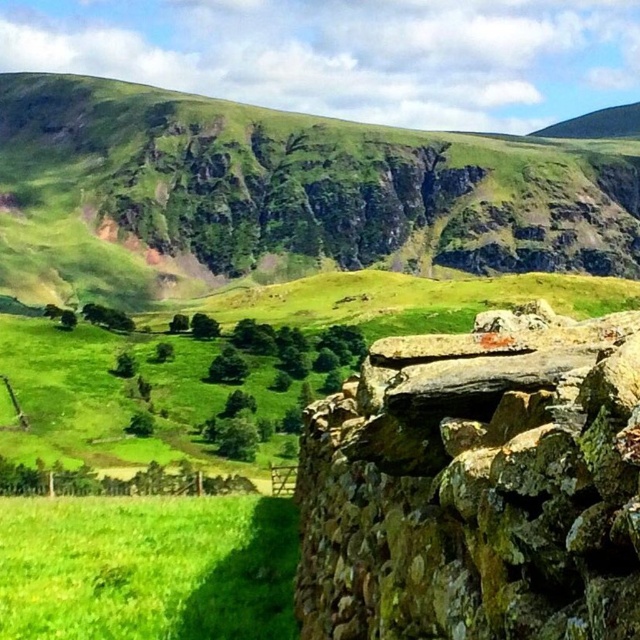
Question: Does green grassy hillside at upper center have a larger size compared to green grassy field at lower left?

Choices:
 (A) yes
 (B) no

Answer: (A)

Question: Which point is closer to the camera?

Choices:
 (A) green grassy hillside at upper center
 (B) green grassy field at lower left

Answer: (B)

Question: Is the position of green grassy hillside at upper center less distant than that of green grassy field at lower left?

Choices:
 (A) yes
 (B) no

Answer: (B)

Question: Does rusty stone cliff at right have a lesser width compared to green grassy field at lower left?

Choices:
 (A) yes
 (B) no

Answer: (A)

Question: Based on their relative distances, which object is farther from the rusty stone cliff at right?

Choices:
 (A) green grassy field at lower left
 (B) green grassy hillside at upper center

Answer: (B)

Question: Which of these objects is positioned farthest from the green grassy field at lower left?

Choices:
 (A) green grassy hillside at upper center
 (B) rusty stone cliff at right

Answer: (A)